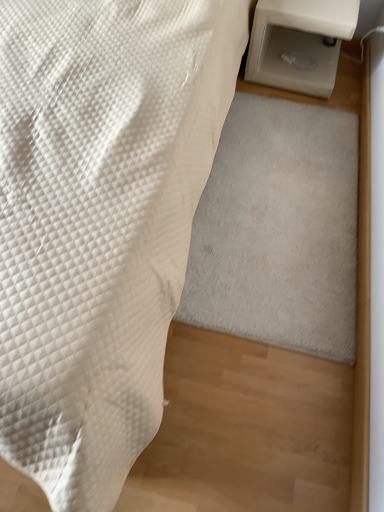
Question: Does white soft rug at lower right have a greater width compared to white plastic table at right?

Choices:
 (A) yes
 (B) no

Answer: (A)

Question: Can you confirm if white soft rug at lower right is bigger than white plastic table at right?

Choices:
 (A) yes
 (B) no

Answer: (B)

Question: Considering the relative positions of white soft rug at lower right and white plastic table at right in the image provided, is white soft rug at lower right to the left of white plastic table at right from the viewer's perspective?

Choices:
 (A) yes
 (B) no

Answer: (A)

Question: Is white soft rug at lower right facing towards white plastic table at right?

Choices:
 (A) no
 (B) yes

Answer: (A)

Question: Is white soft rug at lower right to the right of white plastic table at right from the viewer's perspective?

Choices:
 (A) yes
 (B) no

Answer: (B)

Question: Would you say white soft rug at lower right is outside white plastic table at right?

Choices:
 (A) yes
 (B) no

Answer: (A)

Question: Is white quilted fabric at lower left not near white plastic table at right?

Choices:
 (A) yes
 (B) no

Answer: (B)

Question: Is white quilted fabric at lower left wider than white plastic table at right?

Choices:
 (A) yes
 (B) no

Answer: (A)

Question: Does white quilted fabric at lower left have a greater height compared to white plastic table at right?

Choices:
 (A) yes
 (B) no

Answer: (A)

Question: Could you tell me if white quilted fabric at lower left is turned towards white plastic table at right?

Choices:
 (A) yes
 (B) no

Answer: (B)

Question: Is white quilted fabric at lower left at the right side of white plastic table at right?

Choices:
 (A) no
 (B) yes

Answer: (A)

Question: Does white quilted fabric at lower left come behind white plastic table at right?

Choices:
 (A) no
 (B) yes

Answer: (A)

Question: From a real-world perspective, is white plastic table at right below white quilted fabric at lower left?

Choices:
 (A) no
 (B) yes

Answer: (B)